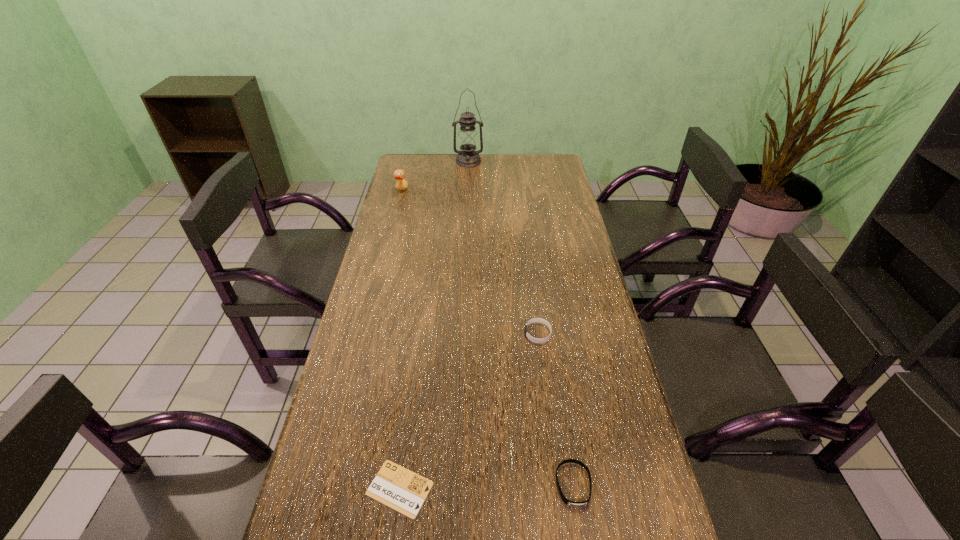
The image size is (960, 540). Identify the location of free space at the left edge of the desktop. (403, 281).

This screenshot has width=960, height=540. In the image, there is a desktop. What are the coordinates of `vacant space at the right edge` in the screenshot? It's located at (598, 347).

You are a GUI agent. You are given a task and a screenshot of the screen. Output one action in this format:
    pyautogui.click(x=<x>, y=<y>)
    Task: Click on the blank area at the far left corner
    
    Given the screenshot: What is the action you would take?
    pyautogui.click(x=416, y=174)

Find the location of a particular element. free space between the second shortest object and the shortest object is located at coordinates (487, 487).

The image size is (960, 540). Identify the location of vacant space in between the taller wristband and the fourth shortest object. (469, 262).

Locate an element on the screen. blank region between the duck and the shortest object is located at coordinates (400, 340).

You are a GUI agent. You are given a task and a screenshot of the screen. Output one action in this format:
    pyautogui.click(x=<x>, y=<y>)
    Task: Click on the free area in between the nearer wristband and the third shortest object
    This screenshot has height=540, width=960.
    Given the screenshot: What is the action you would take?
    pyautogui.click(x=556, y=409)

Where is `free space between the shorter wristband and the fourth shortest object`? Image resolution: width=960 pixels, height=540 pixels. free space between the shorter wristband and the fourth shortest object is located at coordinates (488, 338).

Find the location of a particular element. empty location between the duck and the farthest object is located at coordinates (435, 177).

Find the location of a particular element. vacant area that lies between the nearer wristband and the shortest object is located at coordinates (487, 487).